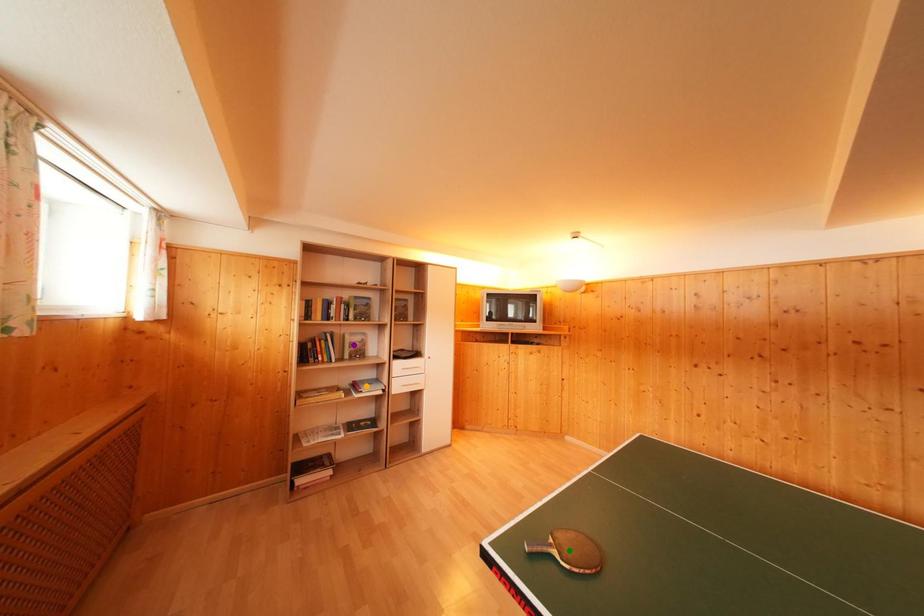
Order these from nearest to farthest:
1. green point
2. purple point
3. orange point

green point, orange point, purple point